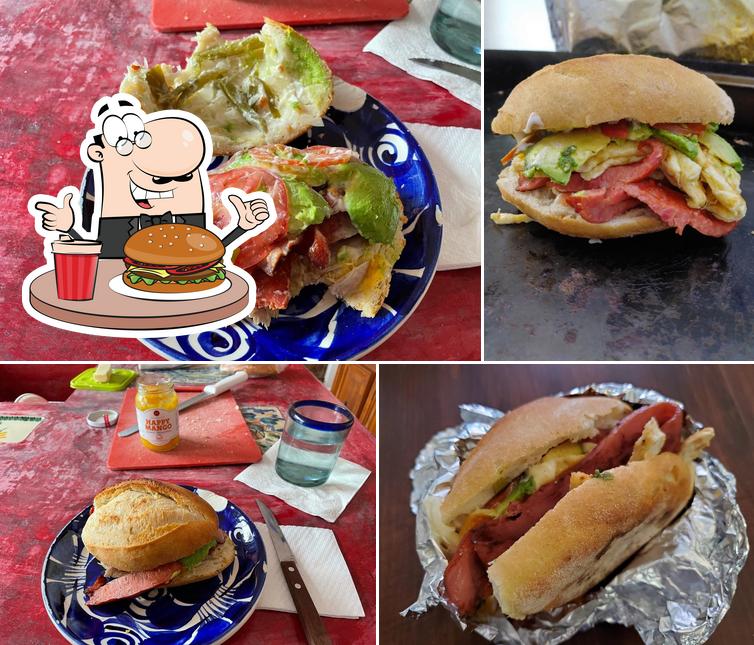
Identify the location of cutting board. The image size is (754, 645). tap(204, 451), tap(231, 8).